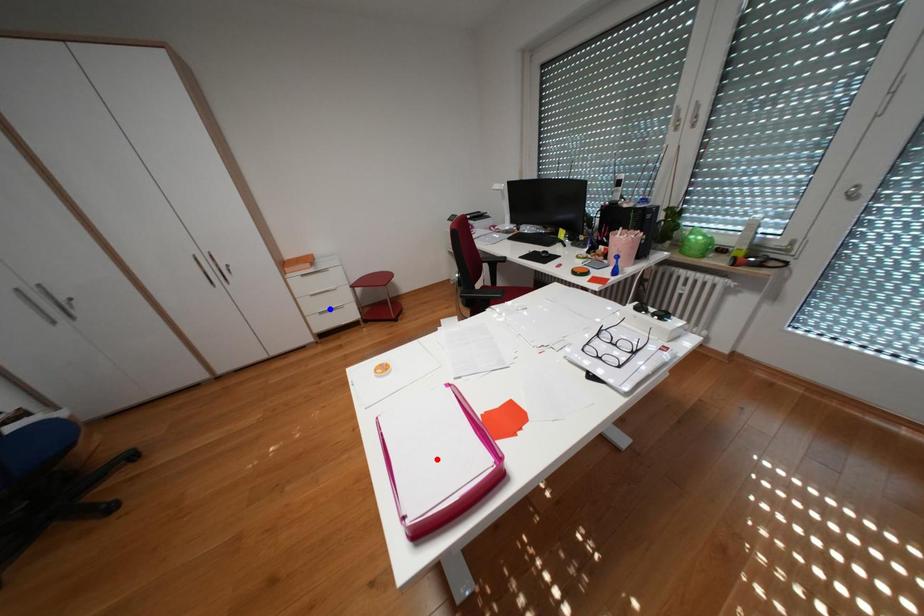
Question: Which of the two points in the image is closer to the camera?

Choices:
 (A) Blue point is closer.
 (B) Red point is closer.

Answer: (B)